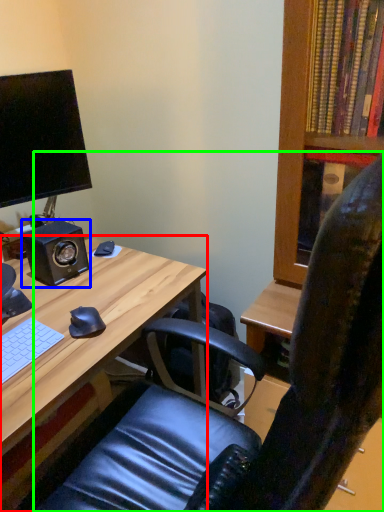
Question: Based on their relative distances, which object is nearer to desk (highlighted by a red box)? Choose from speaker (highlighted by a blue box) and chair (highlighted by a green box).

Choices:
 (A) speaker
 (B) chair

Answer: (A)